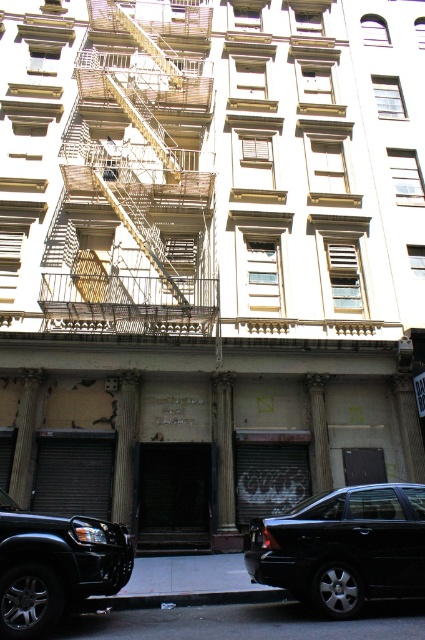
You are a delivery person trying to park your 5.5 meter long truck between the yellow metal fire escape at left and the shiny black sedan at center. Can you fit your truck in that space?

The distance between the yellow metal fire escape at left and the shiny black sedan at center is 9.43 meters. Since your truck is 5.5 meters long, there is enough space to park it between them.

You are a delivery driver approaching the building and need to park your black matte suv at lower left. There is a yellow metal fire escape at left nearby. Which side of the fire escape should you park on?

The yellow metal fire escape at left is to the left of the black matte suv at lower left, so you should park the black matte suv at lower left to the right side of the yellow metal fire escape at left.

You are a delivery person trying to park your van between the shiny black sedan at center and the black matte suv at lower left. Can you safely park there without blocking either vehicle?

The black matte suv at lower left is behind the shiny black sedan at center, so there is space between them. However, since the suv is behind the sedan, the area between them may not be sufficient for parking a van. It is safer to check the available space before attempting to park.